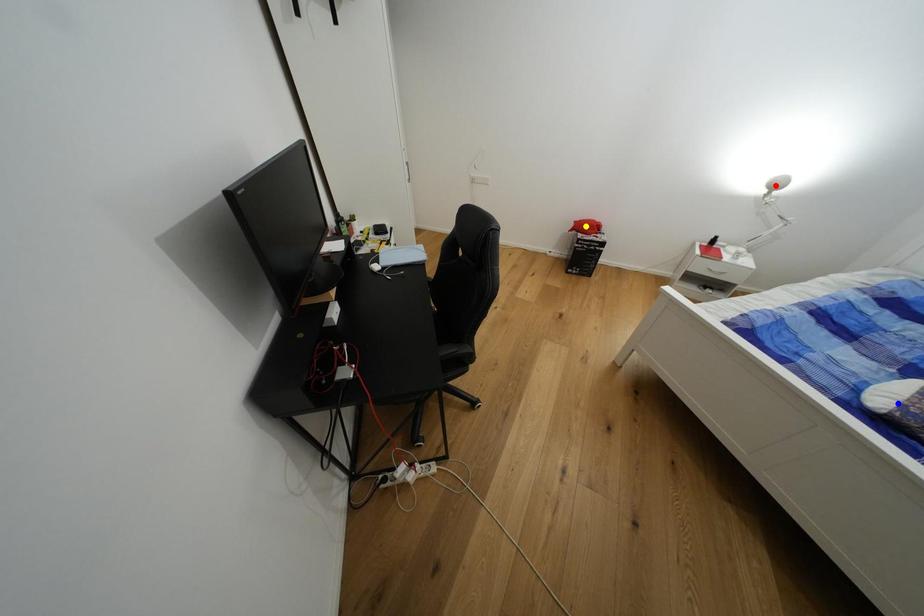
Order these from farthest to nearest:
blue point | yellow point | red point

yellow point < red point < blue point